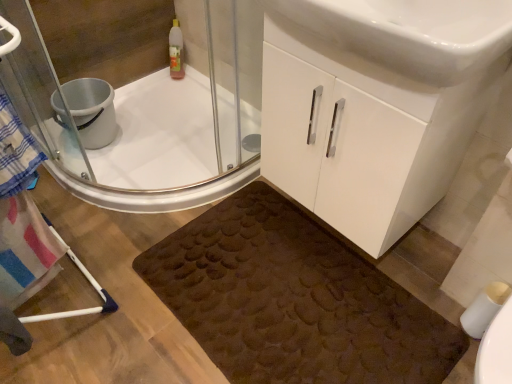
Locate an element on the screen. The image size is (512, 384). free point behind clear glass shower door at upper left is located at coordinates (188, 140).